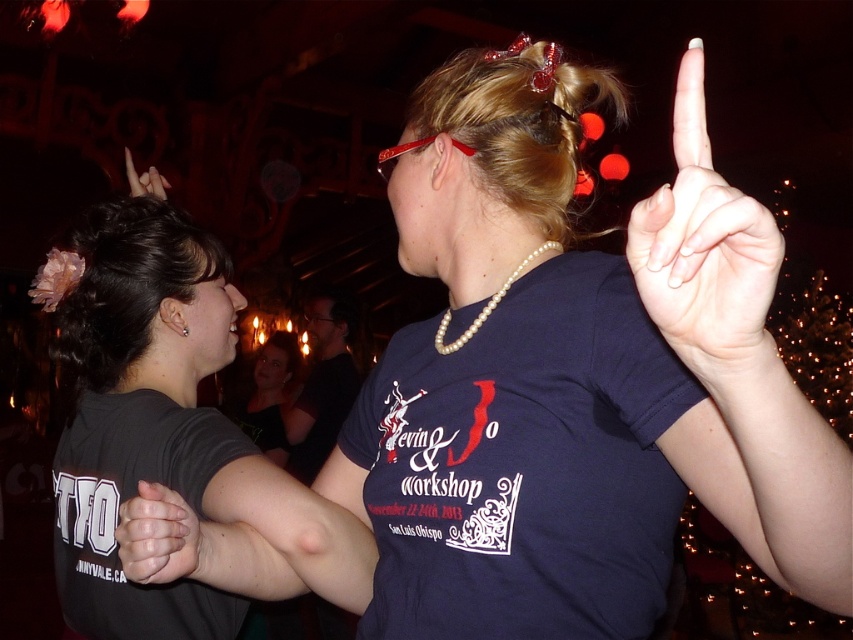
Question: Is navy blue t-shirt at upper center closer to the viewer compared to matte black hands at center?

Choices:
 (A) no
 (B) yes

Answer: (B)

Question: Which point is farther from the camera taking this photo?

Choices:
 (A) (695, 310)
 (B) (267, 362)

Answer: (B)

Question: Which point appears closest to the camera in this image?

Choices:
 (A) (474, 317)
 (B) (426, 625)
 (C) (151, 524)

Answer: (C)

Question: Which object appears farthest from the camera in this image?

Choices:
 (A) black matte shirt at upper left
 (B) pearl necklace at center

Answer: (B)

Question: Does white painted fingernails at upper right appear under matte black hands at center?

Choices:
 (A) yes
 (B) no

Answer: (B)

Question: Does white painted fingernails at upper right come in front of matte black hands at center?

Choices:
 (A) no
 (B) yes

Answer: (B)